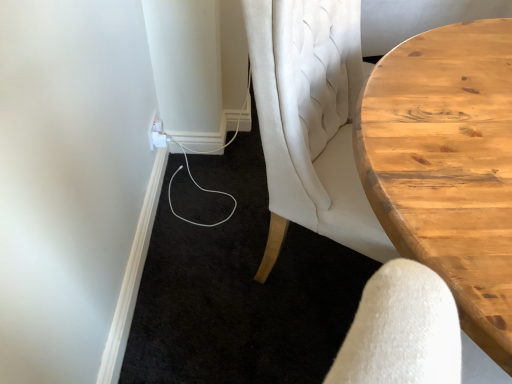
What is the approximate height of wooden table at right?

It is 3.34 feet.

Where is `wooden table at right`? The image size is (512, 384). wooden table at right is located at coordinates (447, 166).

The width and height of the screenshot is (512, 384). What do you see at coordinates (447, 166) in the screenshot?
I see `wooden table at right` at bounding box center [447, 166].

In order to face white plastic outlet at lower left, should I rotate leftwards or rightwards?

Turn left approximately 13.296 degrees to face it.

Identify the location of white plastic outlet at lower left. The image size is (512, 384). (156, 133).

Measure the distance between point [163,129] and camera.

Point [163,129] is 5.60 feet from camera.

The image size is (512, 384). What do you see at coordinates (156, 133) in the screenshot?
I see `white plastic outlet at lower left` at bounding box center [156, 133].

What are the coordinates of `wooden table at right` in the screenshot? It's located at (447, 166).

Which is more to the right, wooden table at right or white plastic outlet at lower left?

Positioned to the right is wooden table at right.

Relative to white plastic outlet at lower left, is wooden table at right in front or behind?

wooden table at right is positioned closer to the viewer than white plastic outlet at lower left.

Which is in front, point (398, 228) or point (156, 144)?

The point (398, 228) is closer.

From the image's perspective, which one is positioned lower, wooden table at right or white plastic outlet at lower left?

From the image's view, wooden table at right is below.

From a real-world perspective, does wooden table at right stand above white plastic outlet at lower left?

Indeed, from a real-world perspective, wooden table at right stands above white plastic outlet at lower left.

Is wooden table at right wider or thinner than white plastic outlet at lower left?

Considering their sizes, wooden table at right looks broader than white plastic outlet at lower left.

Does wooden table at right have a greater height compared to white plastic outlet at lower left?

Yes, wooden table at right is taller than white plastic outlet at lower left.

Considering the sizes of objects wooden table at right and white plastic outlet at lower left in the image provided, who is bigger, wooden table at right or white plastic outlet at lower left?

wooden table at right is bigger.

Is wooden table at right situated inside white plastic outlet at lower left or outside?

wooden table at right is not inside white plastic outlet at lower left, it's outside.

Would you consider wooden table at right to be distant from white plastic outlet at lower left?

wooden table at right is far away from white plastic outlet at lower left.

Is wooden table at right aimed at white plastic outlet at lower left?

No.

How distant is wooden table at right from white plastic outlet at lower left?

wooden table at right is 3.60 feet from white plastic outlet at lower left.

Find the location of a particular element. The image size is (512, 384). electric outlet on the left of wooden table at right is located at coordinates [156, 133].

Considering the relative positions of white plastic outlet at lower left and wooden table at right in the image provided, is white plastic outlet at lower left to the left of wooden table at right from the viewer's perspective?

Indeed, white plastic outlet at lower left is positioned on the left side of wooden table at right.

Relative to wooden table at right, is white plastic outlet at lower left in front or behind?

white plastic outlet at lower left is positioned farther from the viewer than wooden table at right.

Is point (159, 121) closer or farther from the camera than point (502, 161)?

Point (159, 121).

From the image's perspective, is white plastic outlet at lower left below wooden table at right?

No, from the image's perspective, white plastic outlet at lower left is not beneath wooden table at right.

From a real-world perspective, which object stands above the other?

From a 3D spatial view, wooden table at right is above.

Considering the relative sizes of white plastic outlet at lower left and wooden table at right in the image provided, is white plastic outlet at lower left thinner than wooden table at right?

Yes, white plastic outlet at lower left is thinner than wooden table at right.

Does white plastic outlet at lower left have a greater height compared to wooden table at right?

No.

Does white plastic outlet at lower left have a smaller size compared to wooden table at right?

Correct, white plastic outlet at lower left occupies less space than wooden table at right.

Is wooden table at right completely or partially inside white plastic outlet at lower left?

Definitely not — wooden table at right is not inside white plastic outlet at lower left.

From the picture: Are white plastic outlet at lower left and wooden table at right making contact?

No, white plastic outlet at lower left is not with wooden table at right.

Is white plastic outlet at lower left looking in the opposite direction of wooden table at right?

That's not correct — white plastic outlet at lower left is not looking away from wooden table at right.

How many degrees apart are the facing directions of white plastic outlet at lower left and wooden table at right?

The facing directions of white plastic outlet at lower left and wooden table at right are 53.1 degrees apart.

Measure the distance from white plastic outlet at lower left to wooden table at right.

The distance of white plastic outlet at lower left from wooden table at right is 3.60 feet.

Where is `electric outlet behind the wooden table at right`? The height and width of the screenshot is (384, 512). electric outlet behind the wooden table at right is located at coordinates pos(156,133).

In order to click on table located in front of the white plastic outlet at lower left in this screenshot , I will do `click(447, 166)`.

This screenshot has width=512, height=384. What are the coordinates of `electric outlet lying above the wooden table at right (from the image's perspective)` in the screenshot? It's located at (156, 133).